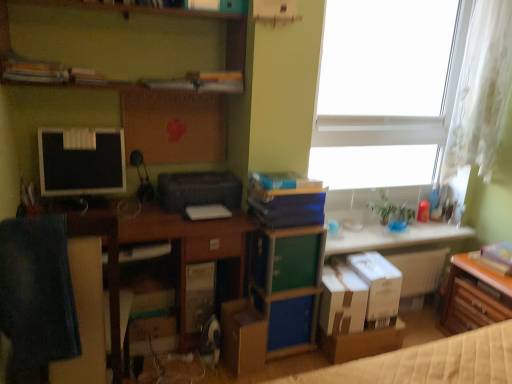
This screenshot has height=384, width=512. What are the coordinates of `free space above white cardboard box at center, the 3th cardboard box viewed from the right (from a real-world perspective)` in the screenshot? It's located at (339, 276).